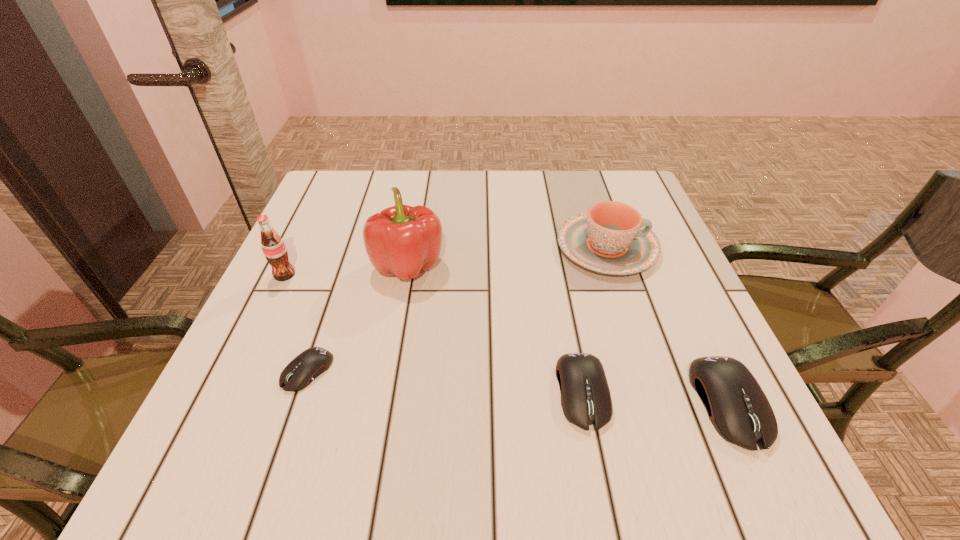
To achieve even spacing by inserting another mouse_(computer_equipment) among them, please point to a vacant spot for this new mouse_(computer_equipment). Please provide its 2D coordinates. Your answer should be formatted as a tuple, i.e. [(x, y)], where the tuple contains the x and y coordinates of a point satisfying the conditions above.

[(442, 381)]